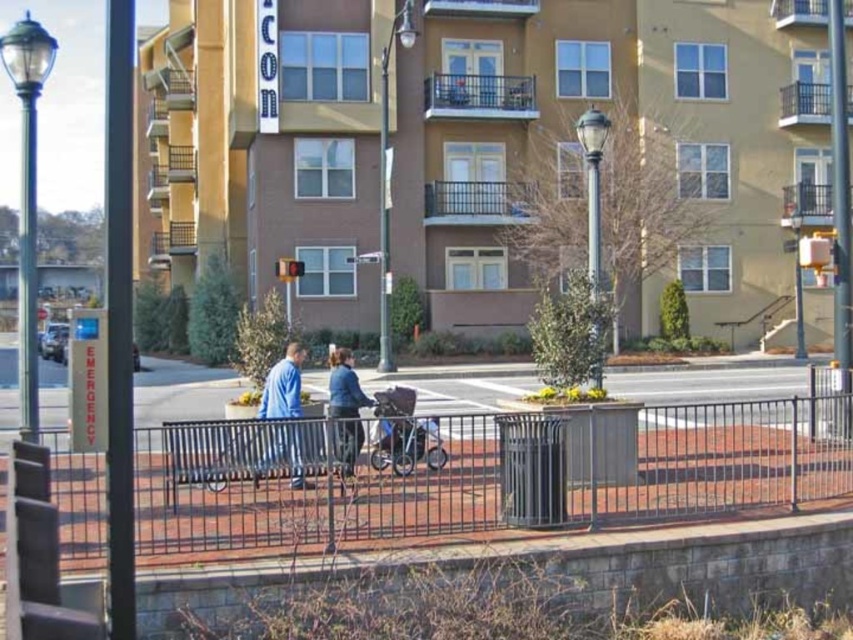
Question: Is the position of green glass lamp post at left less distant than that of blue fabric jacket at center?

Choices:
 (A) no
 (B) yes

Answer: (B)

Question: Which point is farther from the camera taking this photo?

Choices:
 (A) (390, 196)
 (B) (517, 499)
 (C) (22, 252)

Answer: (A)

Question: Observing the image, what is the correct spatial positioning of blue denim jacket at center in reference to metallic gray streetlight at upper right?

Choices:
 (A) above
 (B) below

Answer: (B)

Question: Is black metal streetlight at center further to the viewer compared to blue denim jacket at center?

Choices:
 (A) yes
 (B) no

Answer: (A)

Question: Which object is farther from the camera taking this photo?

Choices:
 (A) metallic gray fence at center
 (B) metallic gray streetlight at center
 (C) green glass lamp post at left

Answer: (B)

Question: Which point is closer to the camera?

Choices:
 (A) (244, 445)
 (B) (606, 122)
 (C) (28, 321)

Answer: (C)